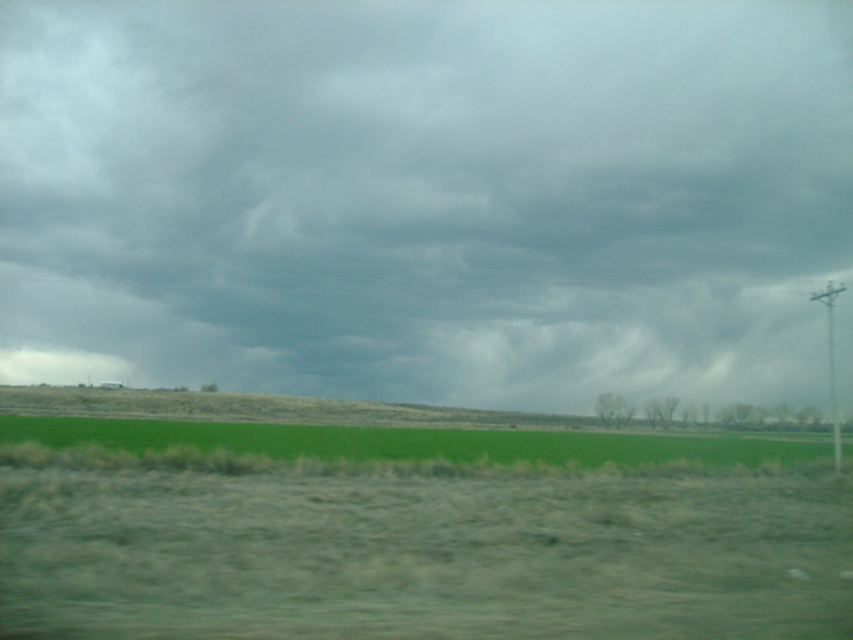
You are a weather observer in the field and see the dark gray cloud at upper center and the green grass at lower center. Which object is bigger in size?

The dark gray cloud at upper center has a larger size compared to the green grass at lower center.